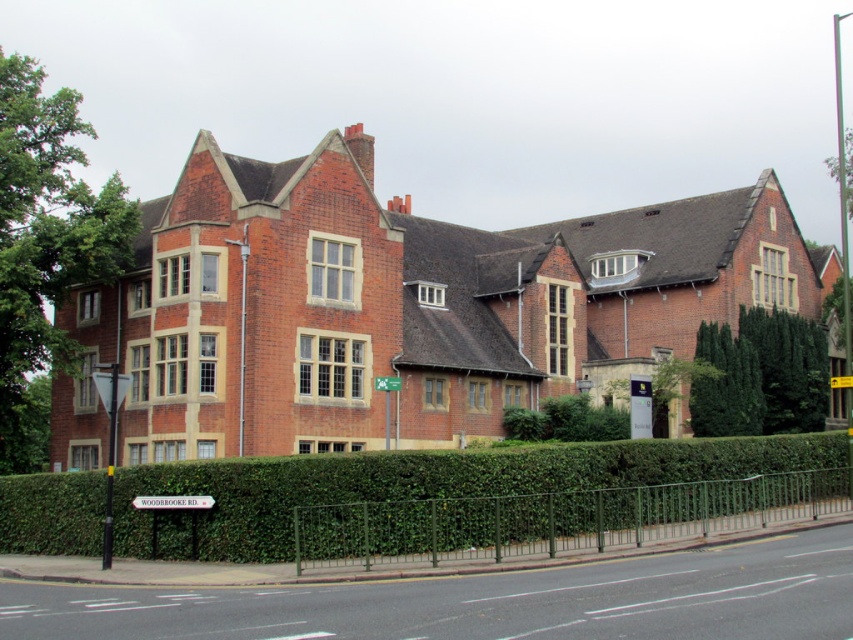
You are a delivery person approaching the building and need to read the green plastic sign at center. Is the sign visible from your current position in front of the dark green leafy hedge at right?

The green plastic sign at center is behind the dark green leafy hedge at right, so it might not be visible from in front of the hedge.

You are a landscape architect designing a pathway between the dark green leafy hedge at right and the green plastic sign at center. If the pathway needs to be at least 1 meter wide, can you determine if there is enough space between them?

The dark green leafy hedge at right might be wider than green plastic sign at center, so the space between them could be sufficient for a 1 meter wide pathway. However, since the exact width isn t specified, further measurement is needed to confirm.